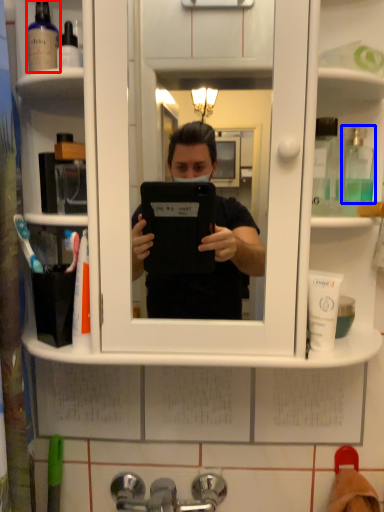
Question: Which object is closer to the camera taking this photo, mouthwash (highlighted by a red box) or mouthwash (highlighted by a blue box)?

Choices:
 (A) mouthwash
 (B) mouthwash

Answer: (B)